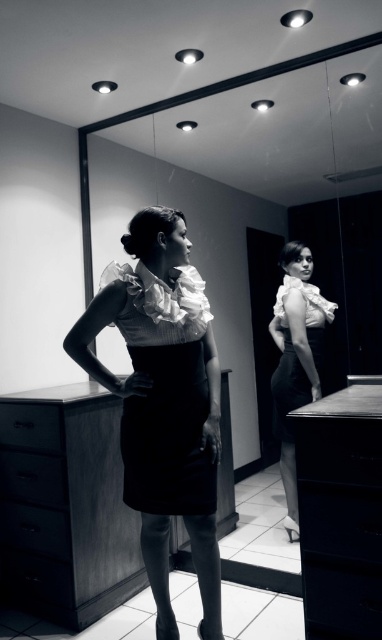
Between dark wood dresser at center and white ruffled blouse at center, which one appears on the left side from the viewer's perspective?

Positioned to the left is dark wood dresser at center.

Measure the distance from dark wood dresser at center to white ruffled blouse at center.

1.20 meters

Between point (59, 406) and point (286, 330), which one is positioned in front?

Point (59, 406) is in front.

Where is `dark wood dresser at center`? The image size is (382, 640). dark wood dresser at center is located at coordinates (66, 506).

The height and width of the screenshot is (640, 382). I want to click on black glossy dresser at lower right, so click(341, 513).

Does black glossy dresser at lower right appear on the left side of black satin dress at center?

Incorrect, black glossy dresser at lower right is not on the left side of black satin dress at center.

Between point (338, 509) and point (160, 353), which one is positioned in front?

Point (338, 509) is more forward.

The image size is (382, 640). Find the location of `black glossy dresser at lower right`. black glossy dresser at lower right is located at coordinates (341, 513).

What do you see at coordinates (341, 520) in the screenshot? I see `black matte drawer at lower center` at bounding box center [341, 520].

Does point (372, 493) come farther from viewer compared to point (27, 531)?

No.

Image resolution: width=382 pixels, height=640 pixels. Describe the element at coordinates (341, 520) in the screenshot. I see `black matte drawer at lower center` at that location.

The width and height of the screenshot is (382, 640). Find the location of `black matte drawer at lower center`. black matte drawer at lower center is located at coordinates [x=341, y=520].